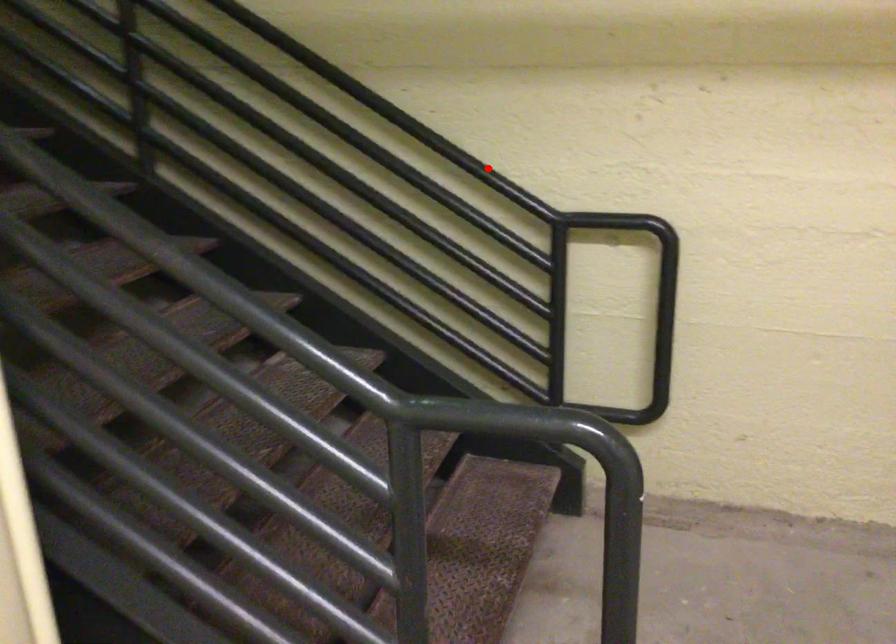
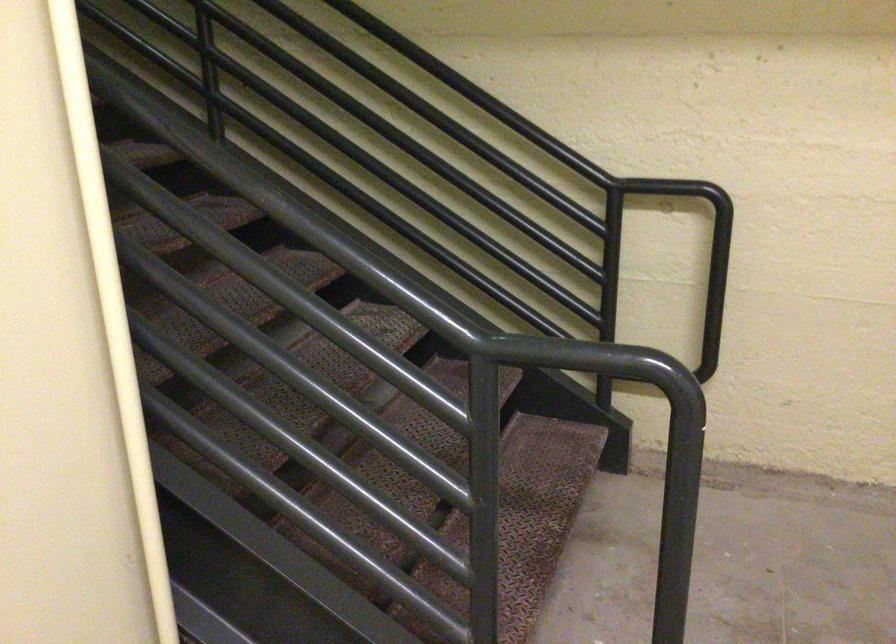
Question: I am providing you with two images of the same scene from different viewpoints. Given a red point in image1, look at the same physical point in image2. Is it:

Choices:
 (A) Closer to the viewpoint
 (B) Farther from the viewpoint

Answer: (B)